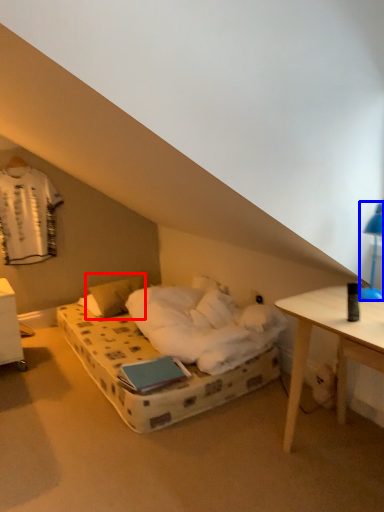
Question: Which of the following is the farthest to the observer, pillow (highlighted by a red box) or bedside lamp (highlighted by a blue box)?

Choices:
 (A) pillow
 (B) bedside lamp

Answer: (A)